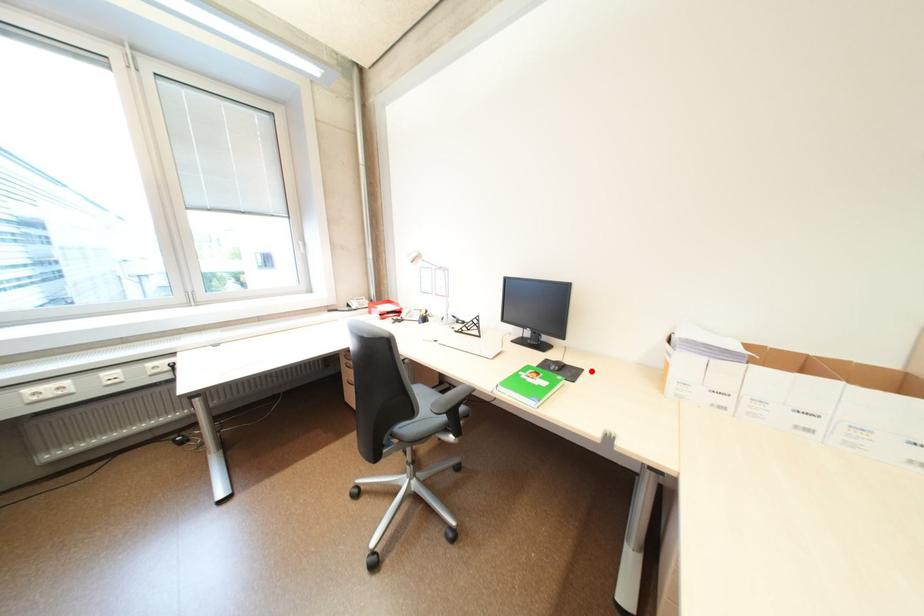
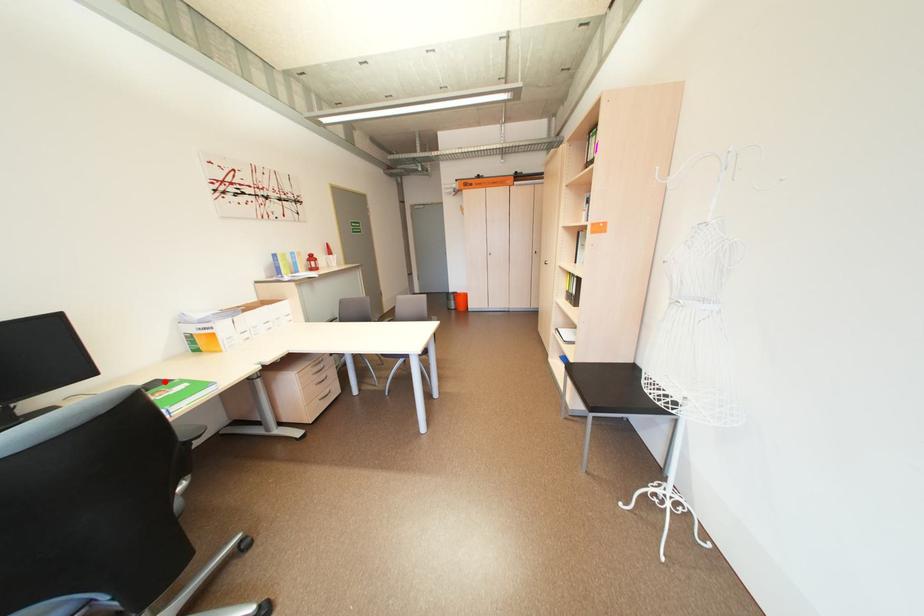
I am providing you with two images of the same scene from different viewpoints. A red point is marked on the first image and another point is marked on the second image. Is the marked point in image1 the same physical position as the marked point in image2?

Yes